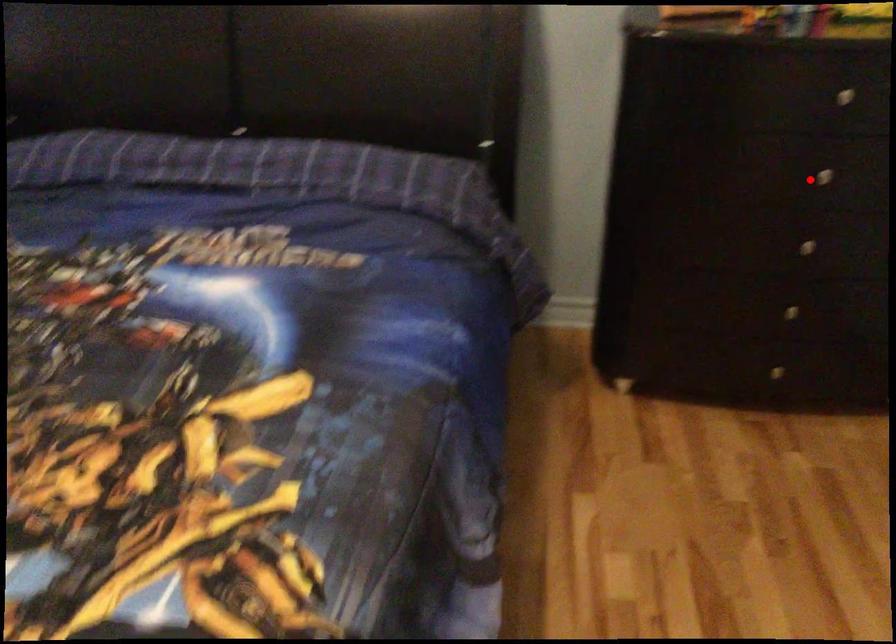
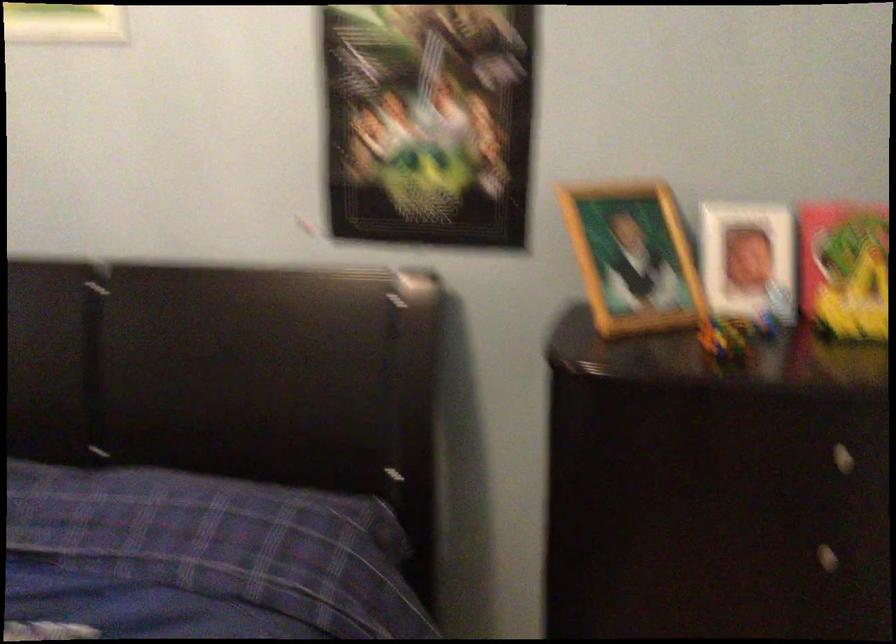
Question: I am providing you with two images of the same scene from different viewpoints. In image1, a red point is highlighted. Considering the same 3D point in image2, which of the following is correct?

Choices:
 (A) It is closer
 (B) It is farther

Answer: (A)